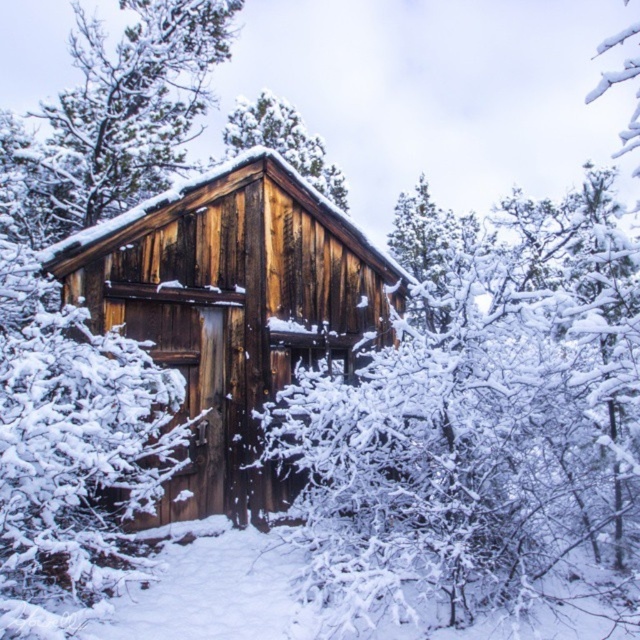
Which is above, wooden cabin at center or snow-covered pine tree at upper left?

Positioned higher is snow-covered pine tree at upper left.

Who is more forward, (332,339) or (122,90)?

Point (332,339) is in front.

At what (x,y) coordinates should I click in order to perform the action: click on wooden cabin at center. Please return your answer as a coordinate pair (x, y). The height and width of the screenshot is (640, 640). Looking at the image, I should click on (232, 307).

Does snow-covered pine tree at upper left have a greater height compared to snow-covered pine tree at center?

Yes.

Is snow-covered pine tree at upper left bigger than snow-covered pine tree at center?

Yes.

Identify the location of snow-covered pine tree at upper left. The image size is (640, 640). click(120, 115).

The width and height of the screenshot is (640, 640). What are the coordinates of `snow-covered pine tree at upper left` in the screenshot? It's located at (120, 115).

Is point (259, 272) in front of point (248, 141)?

Yes, it is.

Where is `wooden cabin at center`? The image size is (640, 640). wooden cabin at center is located at coordinates (232, 307).

Where is `wooden cabin at center`? The height and width of the screenshot is (640, 640). wooden cabin at center is located at coordinates (232, 307).